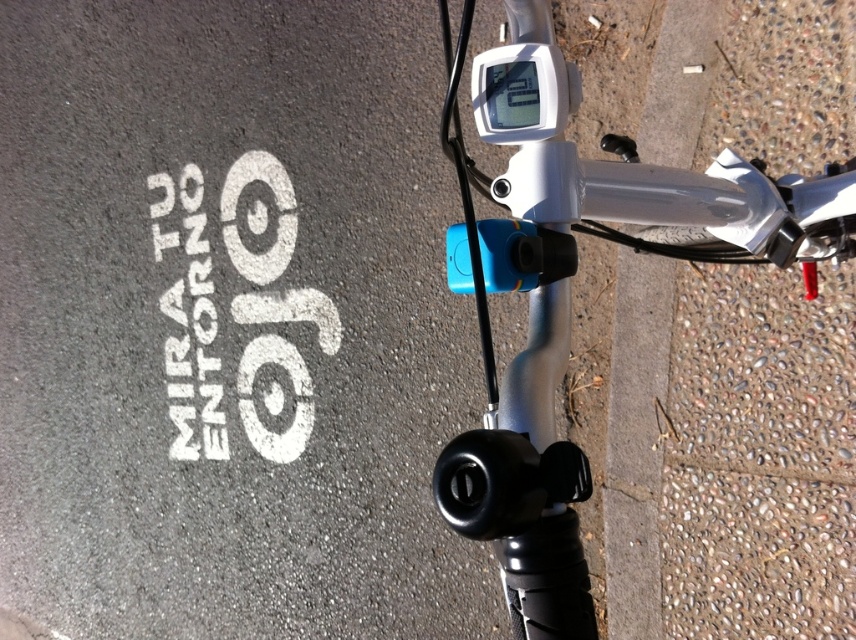
Is silver metallic bicycle handlebar at center bigger than white painted text at lower left?

No, silver metallic bicycle handlebar at center is not bigger than white painted text at lower left.

Between silver metallic bicycle handlebar at center and white painted text at lower left, which one appears on the right side from the viewer's perspective?

silver metallic bicycle handlebar at center

Find the location of a particular element. silver metallic bicycle handlebar at center is located at coordinates (569, 291).